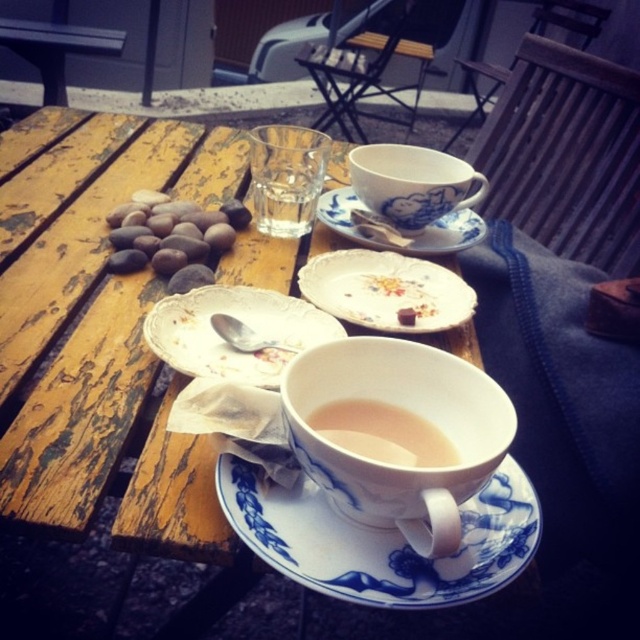
You are a photographer trying to capture the two points in the image. Which point is nearer to your camera lens, point 1 at coordinate point (x=502, y=472) or point 2 at coordinate point (x=198, y=323)?

Point 1 at coordinate point (x=502, y=472) is closer to the camera lens than point 2 at coordinate point (x=198, y=323).

You are a barista preparing a drink for a customer. You have a white porcelain cup at center and a blue porcelain saucer at center. Which object should you place the drink in to ensure it fits properly?

The white porcelain cup at center has a larger size compared to the blue porcelain saucer at center, so you should place the drink in the white porcelain cup at center to ensure it fits properly.

From the picture: You are a customer at this outdoor table and want to place your teacup on the saucer that is closer to the edge of the table. Which saucer should you choose between the blue porcelain saucer at center and the blue porcelain saucer at upper center?

The blue porcelain saucer at center is positioned under the blue porcelain saucer at upper center, so the saucer at center is closer to the edge of the table. You should choose the blue porcelain saucer at center.